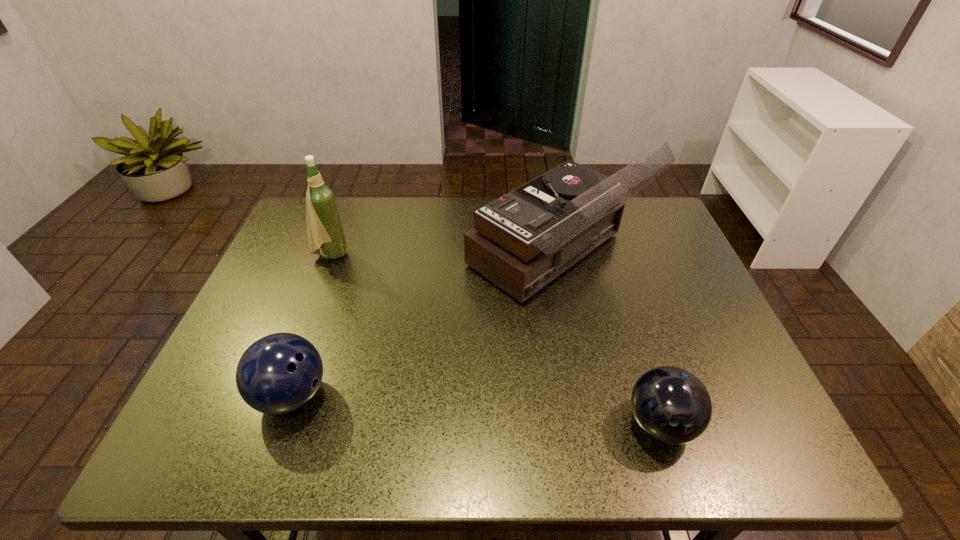
Identify the location of record player located at the right edge. Image resolution: width=960 pixels, height=540 pixels. (522, 241).

Find the location of `bowling ball that is positioned at the right edge`. bowling ball that is positioned at the right edge is located at coordinates (670, 404).

Where is `object that is at the near left corner`? This screenshot has height=540, width=960. object that is at the near left corner is located at coordinates (279, 373).

Image resolution: width=960 pixels, height=540 pixels. Find the location of `object located in the far right corner section of the desktop`. object located in the far right corner section of the desktop is located at coordinates (522, 241).

Where is `object that is positioned at the near right corner`? This screenshot has height=540, width=960. object that is positioned at the near right corner is located at coordinates (670, 404).

This screenshot has height=540, width=960. I want to click on free space at the far edge of the desktop, so click(398, 224).

At what (x,y) coordinates should I click in order to perform the action: click on free space at the near edge of the desktop. Please return your answer as a coordinate pair (x, y). This screenshot has width=960, height=540. Looking at the image, I should click on (495, 444).

In the image, there is a desktop. Identify the location of vacant space at the left edge. Image resolution: width=960 pixels, height=540 pixels. (292, 271).

In the image, there is a desktop. Identify the location of vacant space at the right edge. (714, 371).

Where is `free space at the far right corner of the desktop`? free space at the far right corner of the desktop is located at coordinates (623, 213).